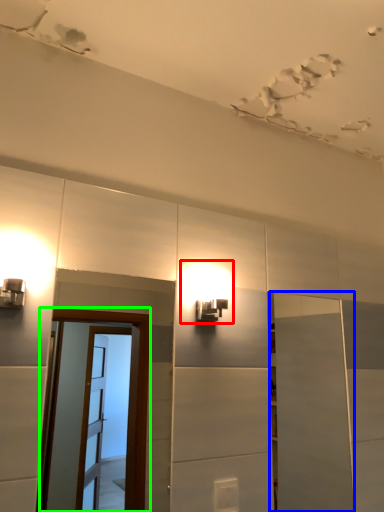
Question: Which object is positioned farthest from light fixture (highlighted by a red box)? Select from door (highlighted by a blue box) and screen door (highlighted by a green box).

Choices:
 (A) door
 (B) screen door

Answer: (B)